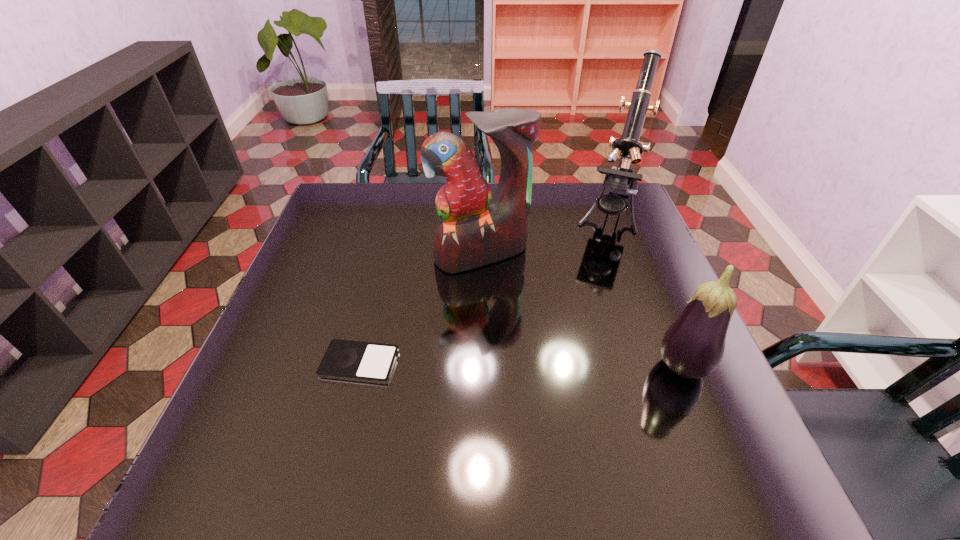
Find the location of a particular element. blank region between the parrot and the iPod is located at coordinates (420, 309).

Find the location of a particular element. The height and width of the screenshot is (540, 960). vacant space that is in between the microscope and the eggplant is located at coordinates (645, 292).

At what (x,y) coordinates should I click in order to perform the action: click on unoccupied area between the third object from right to left and the second shortest object. Please return your answer as a coordinate pair (x, y). This screenshot has width=960, height=540. Looking at the image, I should click on (582, 312).

You are a GUI agent. You are given a task and a screenshot of the screen. Output one action in this format:
    pyautogui.click(x=<x>, y=<y>)
    Task: Click on the empty space between the microscope and the parrot
    This screenshot has height=540, width=960.
    Given the screenshot: What is the action you would take?
    pyautogui.click(x=545, y=235)

What are the coordinates of `vacant space in between the third tallest object and the leftmost object` in the screenshot? It's located at (520, 367).

At what (x,y) coordinates should I click in order to perform the action: click on the second closest object relative to the microscope. Please return your answer as a coordinate pair (x, y). The height and width of the screenshot is (540, 960). Looking at the image, I should click on (x=693, y=346).

Select which object is the second closest to the microscope. Please provide its 2D coordinates. Your answer should be formatted as a tuple, i.e. [(x, y)], where the tuple contains the x and y coordinates of a point satisfying the conditions above.

[(693, 346)]

I want to click on vacant space that satisfies the following two spatial constraints: 1. on the back side of the leftmost object; 2. on the right side of the third object from right to left, so click(x=387, y=254).

The height and width of the screenshot is (540, 960). Identify the location of vacant area in the image that satisfies the following two spatial constraints: 1. on the front side of the second tallest object; 2. on the right side of the second shortest object. (482, 369).